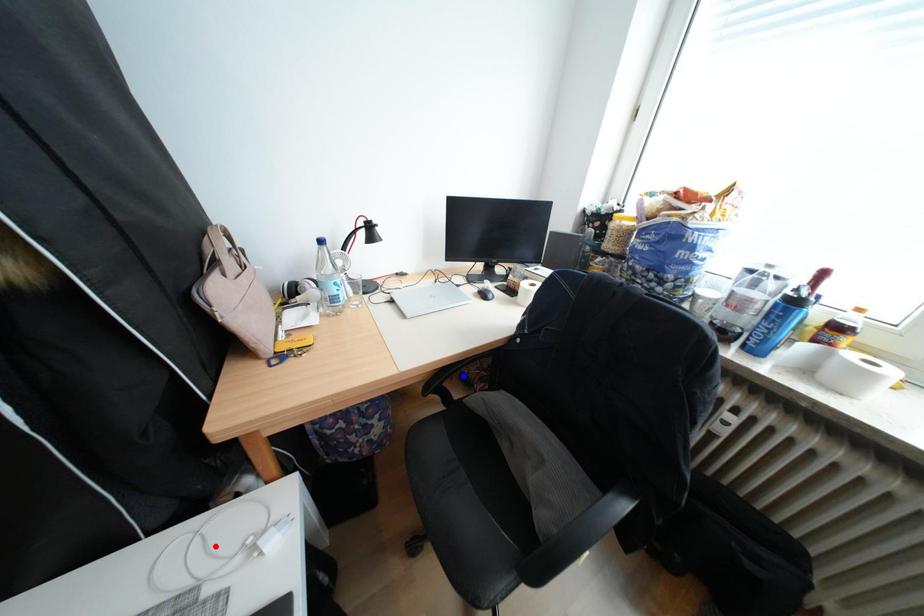
Question: Two points are marked on the image. Which point is closer to the camera?

Choices:
 (A) Blue point is closer.
 (B) Red point is closer.

Answer: (B)